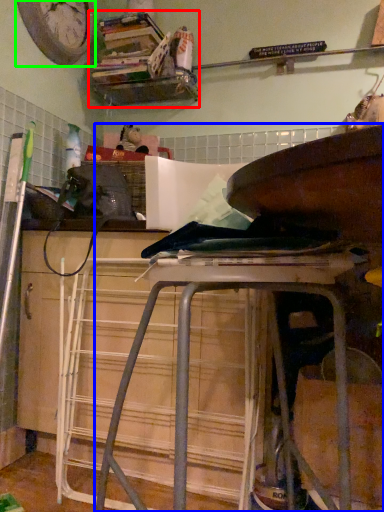
Question: Considering the real-world distances, which object is closest to shelf (highlighted by a red box)? furniture (highlighted by a blue box) or clock (highlighted by a green box).

Choices:
 (A) furniture
 (B) clock

Answer: (B)